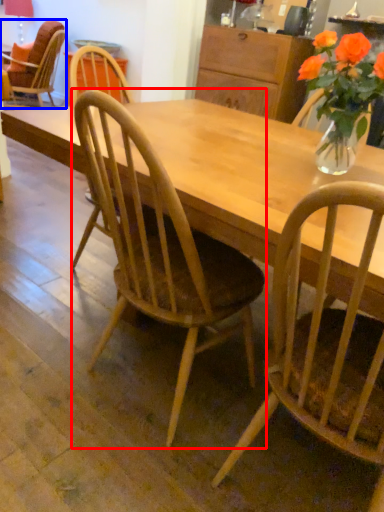
Question: Which of the following is the closest to the observer, chair (highlighted by a red box) or chair (highlighted by a blue box)?

Choices:
 (A) chair
 (B) chair

Answer: (A)